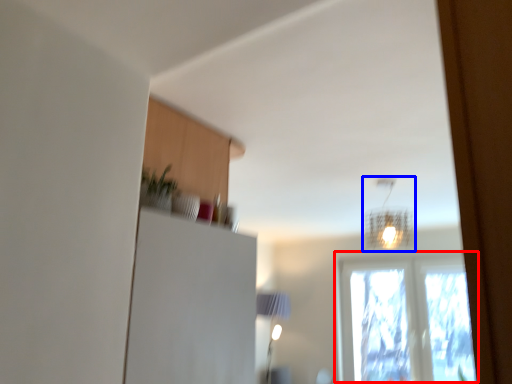
Question: Which object is closer to the camera taking this photo, window (highlighted by a red box) or lamp (highlighted by a blue box)?

Choices:
 (A) window
 (B) lamp

Answer: (B)